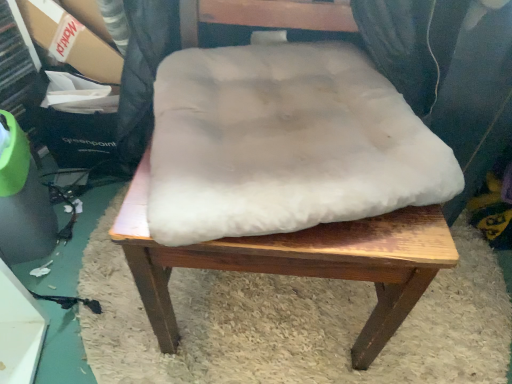
This screenshot has width=512, height=384. Identify the location of free region under white fluffy cushion at center (from a real-world perspective). (264, 314).